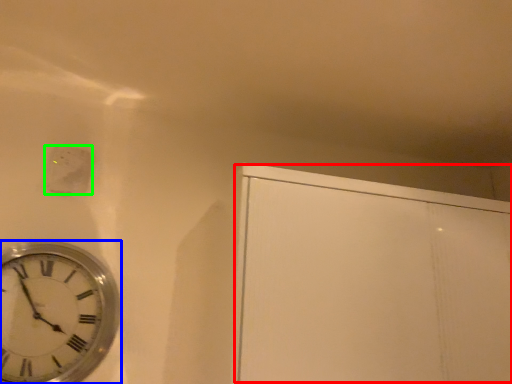
Question: Which object is the farthest from glass door (highlighted by a red box)? Choose among these: wall clock (highlighted by a blue box) or electric outlet (highlighted by a green box).

Choices:
 (A) wall clock
 (B) electric outlet

Answer: (B)